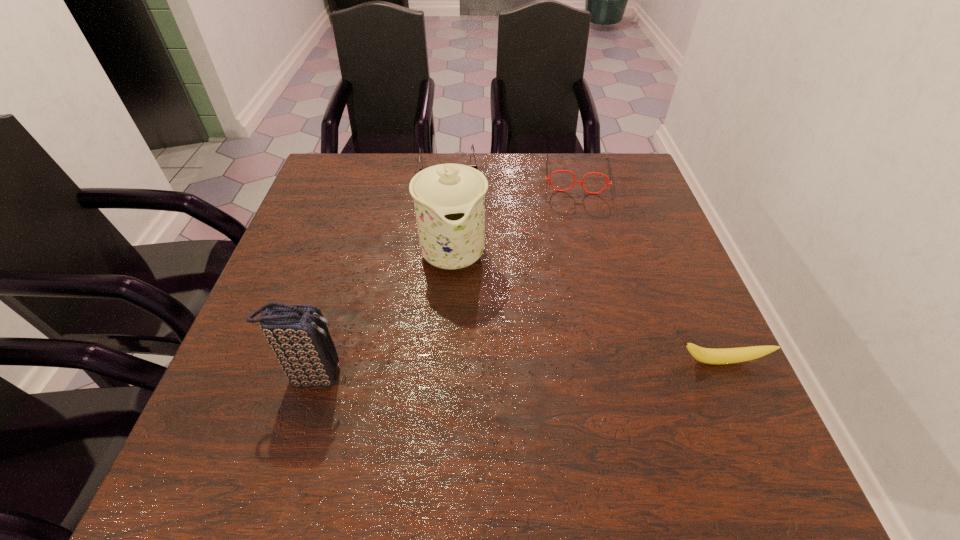
You are a GUI agent. You are given a task and a screenshot of the screen. Output one action in this format:
    pyautogui.click(x=<x>, y=<y>)
    Task: Click on the fourth shortest object
    The width and height of the screenshot is (960, 540).
    Given the screenshot: What is the action you would take?
    pyautogui.click(x=298, y=334)

Image resolution: width=960 pixels, height=540 pixels. What are the coordinates of `clutch bag` in the screenshot? It's located at (298, 334).

The height and width of the screenshot is (540, 960). I want to click on banana, so click(x=705, y=355).

Where is `sunglasses`? sunglasses is located at coordinates (473, 166).

Find the location of a particular element. Image resolution: width=960 pixels, height=540 pixels. chinaware is located at coordinates (449, 199).

Identify the location of the tallest object. This screenshot has height=540, width=960. (449, 199).

Locate an element on the screen. spectacles is located at coordinates (549, 179).

Where is `vacant space situated with the zip open on the second tallest object`? This screenshot has height=540, width=960. vacant space situated with the zip open on the second tallest object is located at coordinates (410, 375).

In order to click on vacant space located on the upward curve of the banana in this screenshot , I will do `click(735, 392)`.

Find the location of `vacant space situated 0.240m at the front lenses of the sunglasses`. vacant space situated 0.240m at the front lenses of the sunglasses is located at coordinates (456, 242).